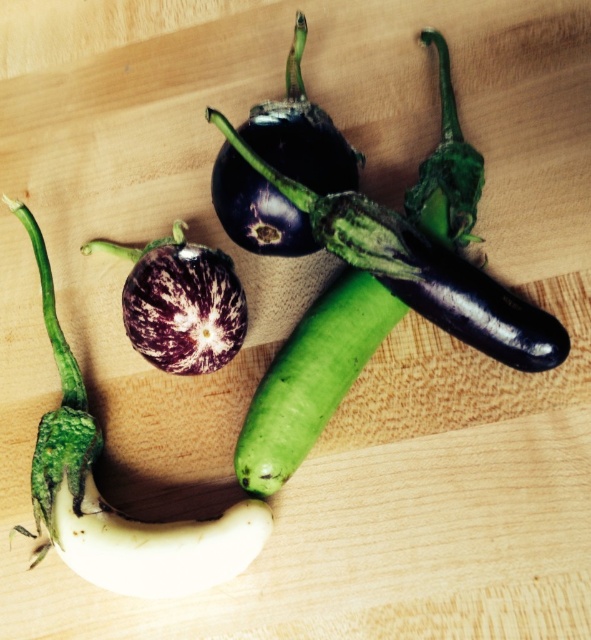
Looking at this image, does shiny purple eggplant at center appear under purple striped eggplant at center?

Actually, shiny purple eggplant at center is above purple striped eggplant at center.

Does shiny purple eggplant at center have a lesser height compared to purple striped eggplant at center?

In fact, shiny purple eggplant at center may be taller than purple striped eggplant at center.

Locate an element on the screen. shiny purple eggplant at center is located at coordinates (420, 269).

Locate an element on the screen. The height and width of the screenshot is (640, 591). shiny purple eggplant at center is located at coordinates (x=420, y=269).

From the picture: Can you confirm if purple glossy eggplant at center is smaller than purple striped eggplant at center?

Incorrect, purple glossy eggplant at center is not smaller in size than purple striped eggplant at center.

Does point (248, 140) come in front of point (160, 269)?

No, it is behind (160, 269).

The width and height of the screenshot is (591, 640). Identify the location of purple glossy eggplant at center. (301, 132).

Which is below, green smooth cucumber at center or purple glossy eggplant at center?

Positioned lower is green smooth cucumber at center.

Is green smooth cucumber at center bigger than purple glossy eggplant at center?

No.

Is point (358, 358) positioned in front of point (235, 230)?

Yes, it is in front of point (235, 230).

Identify the location of green smooth cucumber at center. (311, 378).